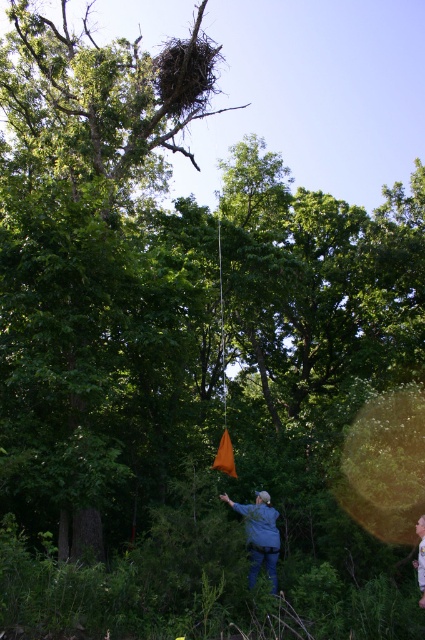
You are a hiker in the forest and see two points marked in the scene. Which point is closer to you, point (124, 140) or point (421, 563)?

Point (124, 140) is closer to you than point (421, 563) because it is further to the viewer.

You are a photographer trying to capture a clear shot of the blue denim jacket at center and the blue denim jeans at lower center. Since the trees are dense, you need to adjust your position. Which direction should you move to ensure both items are visible without obstruction?

You should move to the right side because the blue denim jacket at center is to the left of the blue denim jeans at lower center, so positioning yourself to the right will allow both items to be visible without the trees blocking them.